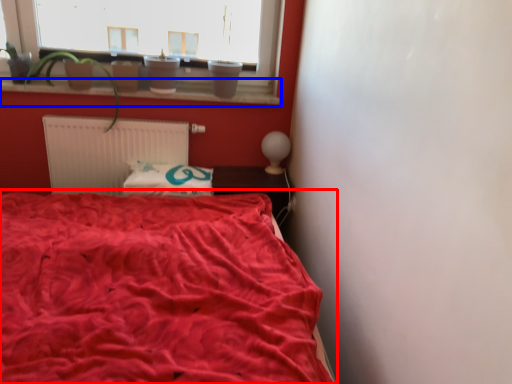
Question: Which object is closer to the camera taking this photo, bed (highlighted by a red box) or window sill (highlighted by a blue box)?

Choices:
 (A) bed
 (B) window sill

Answer: (A)